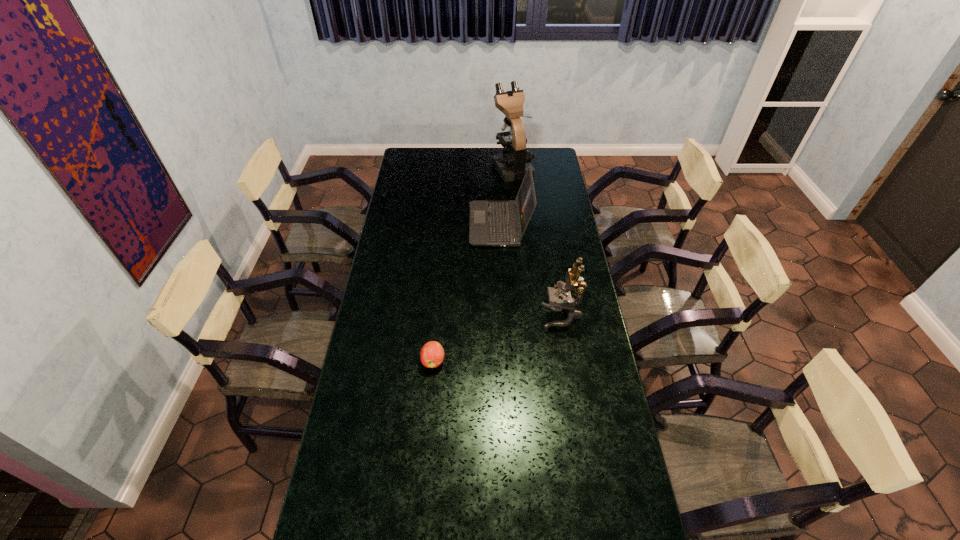
Where is `free space located at the eyepieces of the shorter microscope`? This screenshot has height=540, width=960. free space located at the eyepieces of the shorter microscope is located at coordinates (518, 316).

The image size is (960, 540). I want to click on free space located 0.380m at the eyepieces of the shorter microscope, so click(x=444, y=316).

Find the location of a particular element. This screenshot has height=540, width=960. vacant region located on the screen of the second farthest object is located at coordinates (401, 225).

Where is `vacant space located 0.180m on the screen of the second farthest object`? vacant space located 0.180m on the screen of the second farthest object is located at coordinates (431, 225).

Locate an element on the screen. This screenshot has width=960, height=540. free space located on the screen of the second farthest object is located at coordinates (397, 225).

Identify the location of free location located on the right of the apple. The height and width of the screenshot is (540, 960). pos(493,361).

Find the location of `object at the far edge`. object at the far edge is located at coordinates (512, 164).

Where is `object that is at the far right corner`? object that is at the far right corner is located at coordinates (512, 164).

Locate an element on the screen. blank space at the left edge of the desktop is located at coordinates (382, 243).

The image size is (960, 540). What are the coordinates of `blank space at the right edge` in the screenshot? It's located at (555, 186).